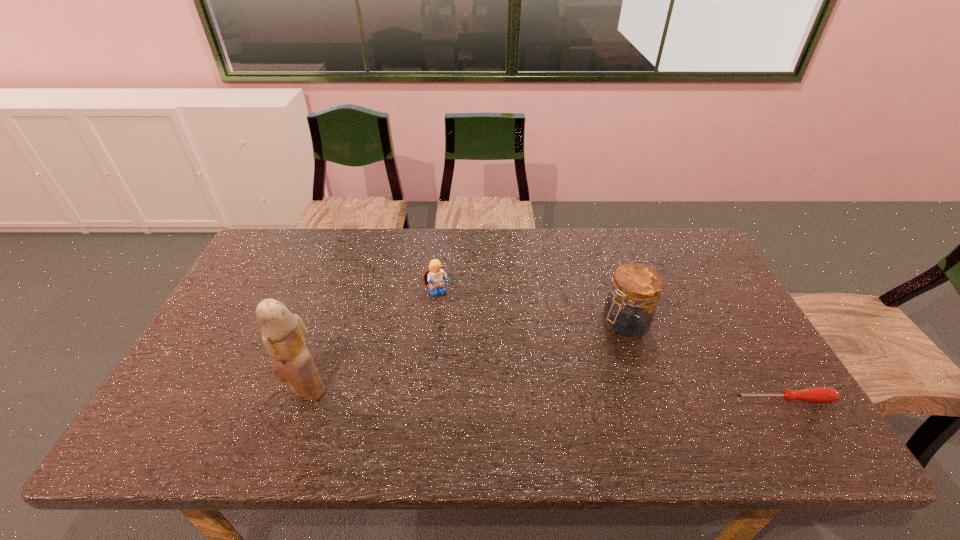
This screenshot has height=540, width=960. In order to click on free space on the desktop that is between the tallest object and the shortest object and is positioned on the lid of the jar in this screenshot , I will do `click(520, 394)`.

Identify the location of free space on the desktop that is between the leftmost object and the rightmost object and is positioned on the front-facing side of the third tallest object. Image resolution: width=960 pixels, height=540 pixels. (503, 394).